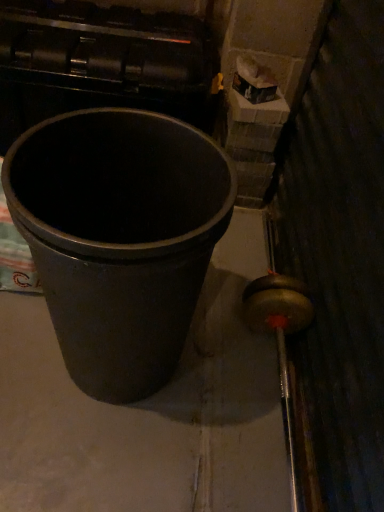
At what (x,y) coordinates should I click in order to perform the action: click on free space in front of matte black trash can at center-left. Please return your answer as a coordinate pair (x, y). Looking at the image, I should click on (108, 458).